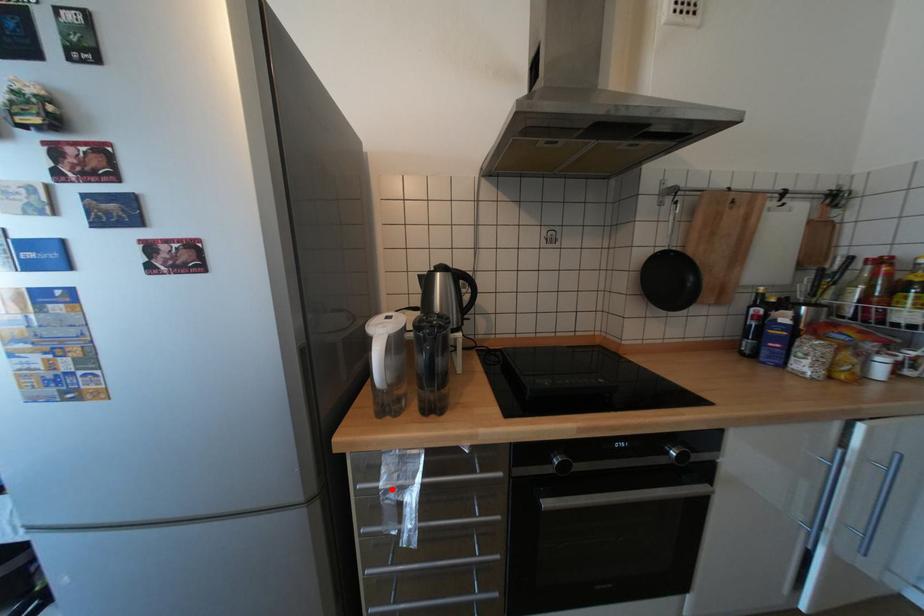
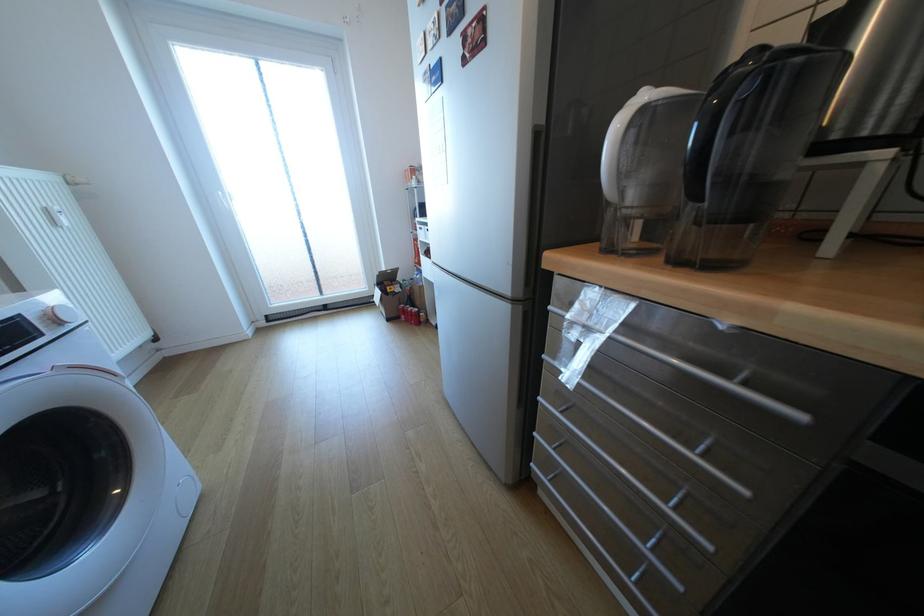
Find the pixel in the second image that matches the highlighted location in the first image.

(578, 320)